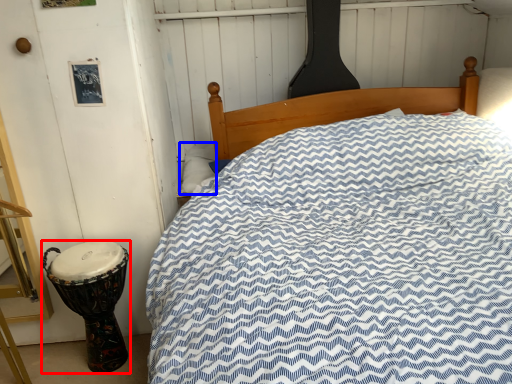
Question: Which object is closer to the camera taking this photo, drum (highlighted by a red box) or pillow (highlighted by a blue box)?

Choices:
 (A) drum
 (B) pillow

Answer: (A)